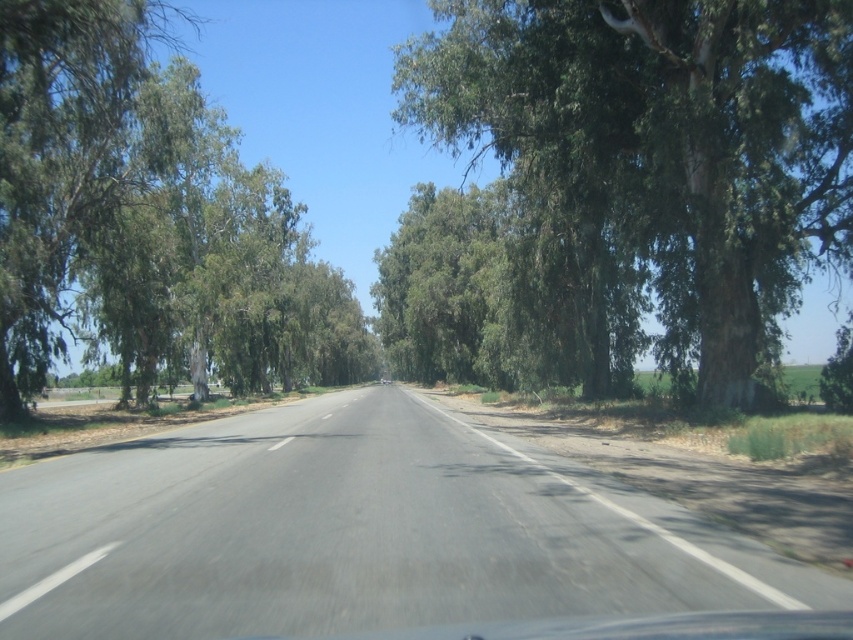
Does asphalt road at center appear on the left side of green leafy tree at right?

Correct, you'll find asphalt road at center to the left of green leafy tree at right.

Can you confirm if asphalt road at center is bigger than green leafy tree at right?

Actually, asphalt road at center might be smaller than green leafy tree at right.

Does point (416, 396) come closer to viewer compared to point (607, 192)?

No, (416, 396) is behind (607, 192).

Where is `asphalt road at center`? This screenshot has width=853, height=640. asphalt road at center is located at coordinates (355, 532).

Is point (252, 552) closer to camera compared to point (33, 131)?

Yes.

Which of these two, asphalt road at center or green leafy tree at left, stands shorter?

asphalt road at center

Does point (207, 515) come closer to viewer compared to point (83, 228)?

Yes, point (207, 515) is in front of point (83, 228).

Where is `asphalt road at center`? Image resolution: width=853 pixels, height=640 pixels. asphalt road at center is located at coordinates (355, 532).

Between point (669, 156) and point (212, 147), which one is positioned in front?

Positioned in front is point (669, 156).

Is green leafy tree at right bigger than green leafy tree at left?

No.

Identify the location of green leafy tree at right. (660, 141).